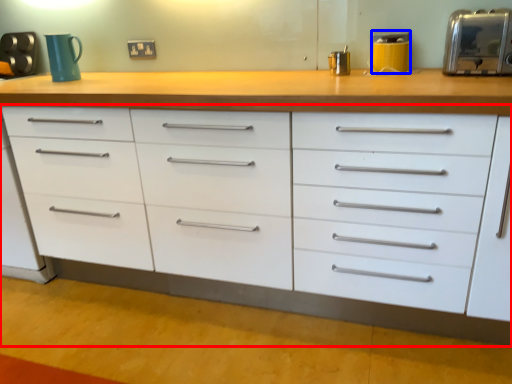
Question: Which point is further to the camera, chest of drawers (highlighted by a red box) or appliance (highlighted by a blue box)?

Choices:
 (A) chest of drawers
 (B) appliance

Answer: (B)